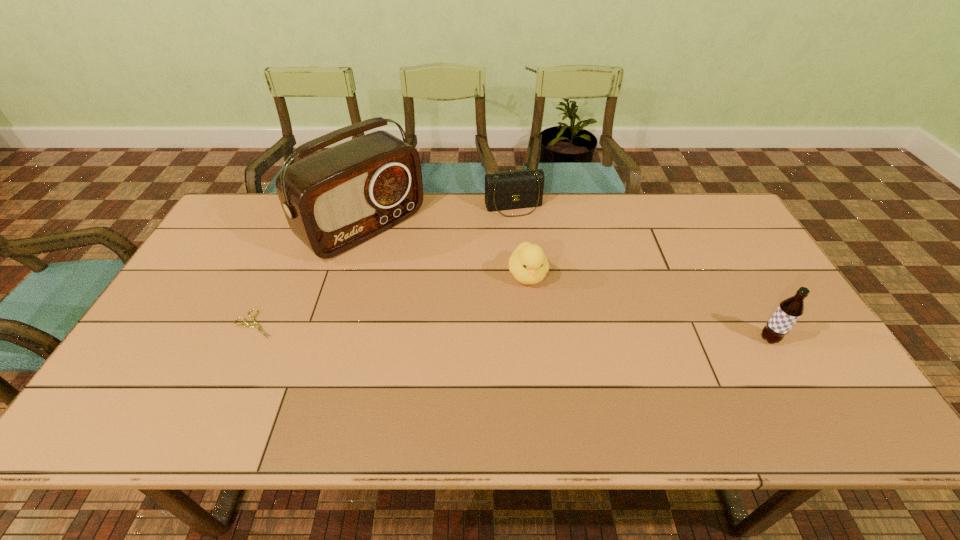
Find the location of a particular element. This screenshot has height=540, width=960. free area in between the shortest object and the tallest object is located at coordinates (309, 276).

Find the location of a particular element. Image resolution: width=960 pixels, height=540 pixels. vacant space that's between the clutch bag and the duck is located at coordinates pos(520,241).

The height and width of the screenshot is (540, 960). I want to click on free space between the radio receiver and the clutch bag, so click(439, 217).

I want to click on vacant space that is in between the duck and the clutch bag, so click(520, 241).

This screenshot has width=960, height=540. Identify the location of empty space between the rightmost object and the shortest object. (512, 332).

Where is `vacant region between the fourth shortest object and the radio receiver`? The image size is (960, 540). vacant region between the fourth shortest object and the radio receiver is located at coordinates (566, 283).

Choose which object is the third nearest neighbor to the second tallest object. Please provide its 2D coordinates. Your answer should be formatted as a tuple, i.e. [(x, y)], where the tuple contains the x and y coordinates of a point satisfying the conditions above.

[(334, 200)]

At what (x,y) coordinates should I click in order to perform the action: click on object that is the closest to the radio receiver. Please return your answer as a coordinate pair (x, y). This screenshot has width=960, height=540. Looking at the image, I should click on (249, 325).

This screenshot has width=960, height=540. What are the coordinates of `vacant space that satisfies the following two spatial constraints: 1. on the back side of the shortest object; 2. on the right side of the tallest object` in the screenshot? It's located at (300, 227).

In order to click on vacant region that satisfies the following two spatial constraints: 1. on the front side of the root beer; 2. on the right side of the tallest object in this screenshot , I will do `click(331, 339)`.